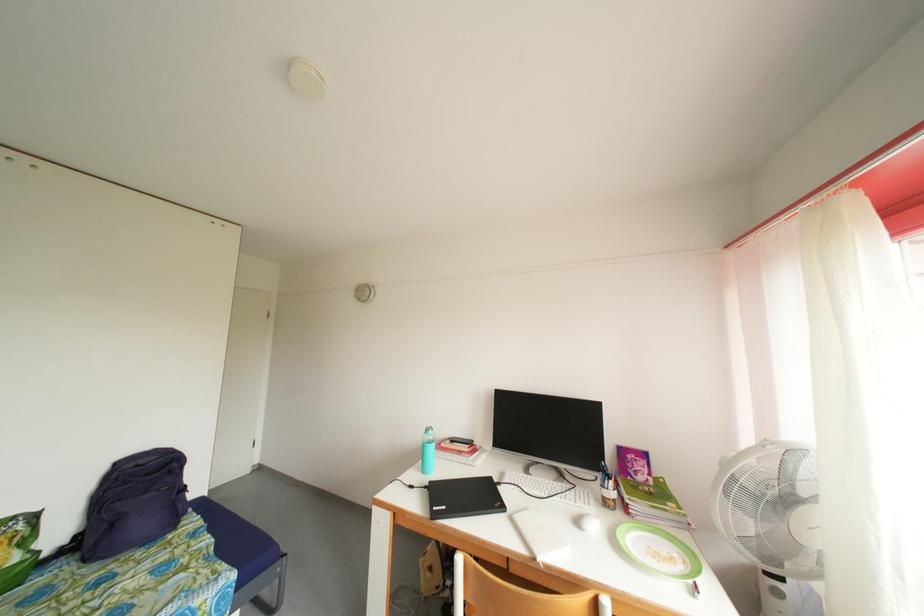
Image resolution: width=924 pixels, height=616 pixels. Find the location of `white and green plate`. white and green plate is located at coordinates (658, 551).